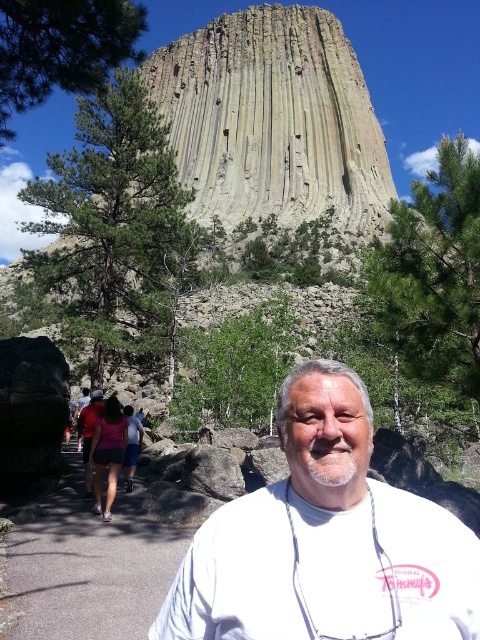
You are standing at the starting point of the gray asphalt path at center. Which direction should you walk to reach the large columnar jointed rock formation in the background?

The gray asphalt path at center is located at point (88, 566). Since the rock formation is in the background, you should walk forward along the gray asphalt path at center towards the direction of the rock formation.